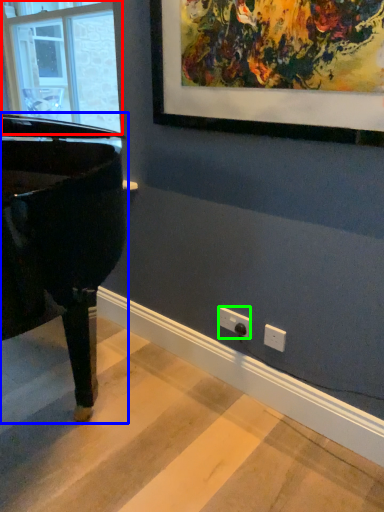
Question: Which object is the farthest from window (highlighted by a red box)? Choose among these: piano (highlighted by a blue box) or electric outlet (highlighted by a green box).

Choices:
 (A) piano
 (B) electric outlet

Answer: (B)